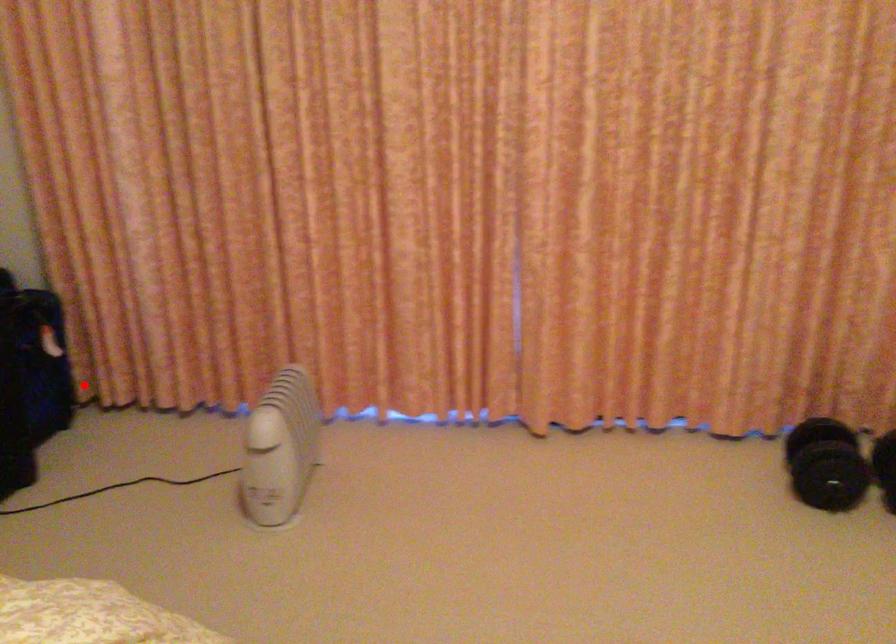
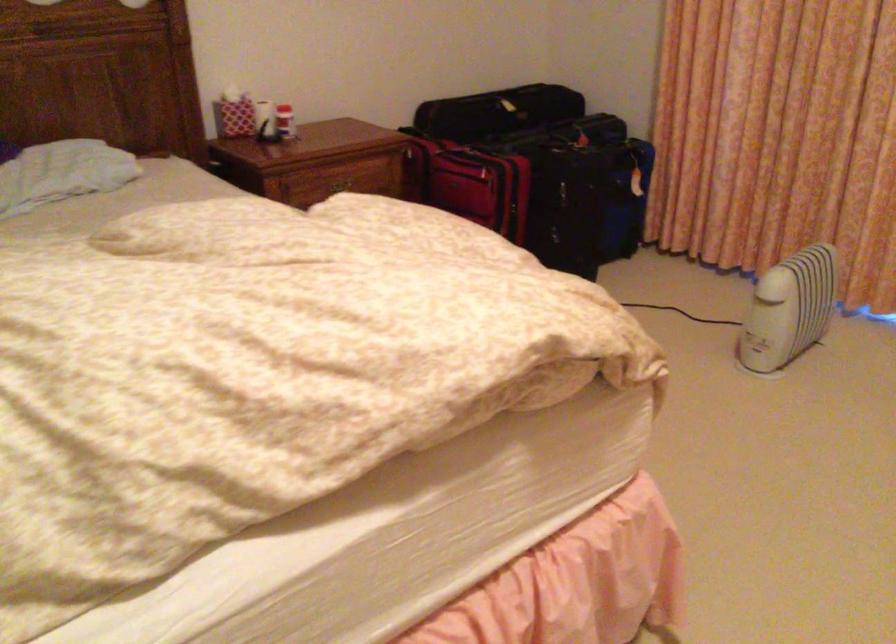
Question: I am providing you with two images of the same scene from different viewpoints. A red point is marked on the first image. Can you still see the location of the red point in image 2?

Choices:
 (A) Yes
 (B) No

Answer: (A)